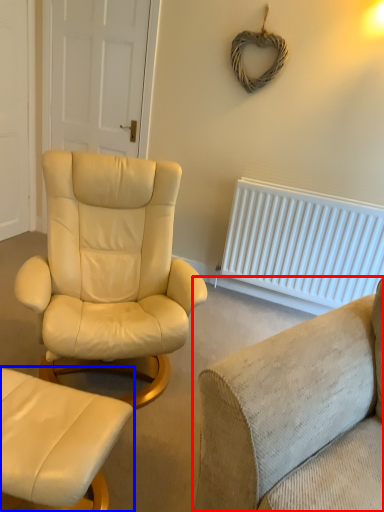
Question: Among these objects, which one is farthest to the camera, studio couch (highlighted by a red box) or chair (highlighted by a blue box)?

Choices:
 (A) studio couch
 (B) chair

Answer: (B)